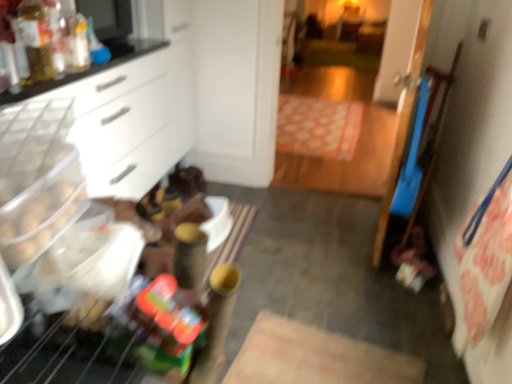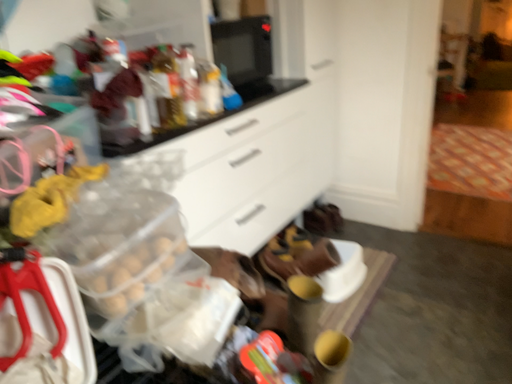
Question: Which way did the camera rotate in the video?

Choices:
 (A) rotated right
 (B) rotated left

Answer: (B)